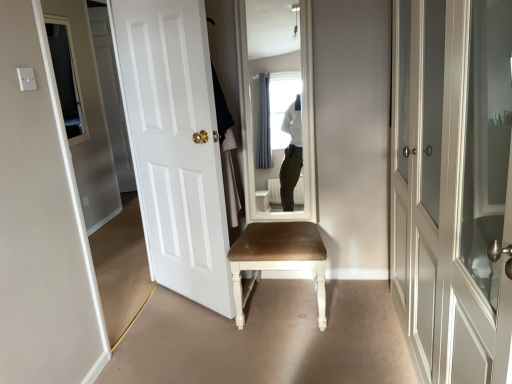
Question: Is white painted wood door at center, the 2th door from the left, at the left side of white cotton robe at center?

Choices:
 (A) no
 (B) yes

Answer: (B)

Question: Is white painted wood door at center, which appears as the second door when viewed from the right, not within white cotton robe at center?

Choices:
 (A) no
 (B) yes

Answer: (B)

Question: Does white painted wood door at center, which appears as the second door when viewed from the right, have a lesser height compared to white cotton robe at center?

Choices:
 (A) no
 (B) yes

Answer: (A)

Question: Is white painted wood door at center, which appears as the second door when viewed from the right, oriented towards white cotton robe at center?

Choices:
 (A) no
 (B) yes

Answer: (B)

Question: From a real-world perspective, is white painted wood door at center, the 2th door from the left, positioned over white cotton robe at center based on gravity?

Choices:
 (A) no
 (B) yes

Answer: (A)

Question: Does point (249, 246) appear closer or farther from the camera than point (229, 160)?

Choices:
 (A) farther
 (B) closer

Answer: (B)

Question: From the image's perspective, relative to white cotton robe at center, is brown leather chair at center above or below?

Choices:
 (A) below
 (B) above

Answer: (A)

Question: From a real-world perspective, is brown leather chair at center physically located above or below white cotton robe at center?

Choices:
 (A) above
 (B) below

Answer: (B)

Question: Considering the positions of brown leather chair at center and white cotton robe at center in the image, is brown leather chair at center bigger or smaller than white cotton robe at center?

Choices:
 (A) small
 (B) big

Answer: (B)

Question: Does point (18, 142) appear closer or farther from the camera than point (225, 122)?

Choices:
 (A) closer
 (B) farther

Answer: (A)

Question: Is white matte door at left, arranged as the third door when viewed from the right, bigger or smaller than white cotton robe at center?

Choices:
 (A) small
 (B) big

Answer: (B)

Question: From a real-world perspective, is white matte door at left, acting as the 1th door starting from the left, physically located above or below white cotton robe at center?

Choices:
 (A) above
 (B) below

Answer: (B)

Question: Which is correct: white matte door at left, arranged as the third door when viewed from the right, is inside white cotton robe at center, or outside of it?

Choices:
 (A) inside
 (B) outside

Answer: (B)

Question: Would you say white cotton robe at center is to the left or to the right of white painted wood door at center, the 2th door from the left, in the picture?

Choices:
 (A) left
 (B) right

Answer: (B)

Question: Considering the positions of point (223, 180) and point (199, 147), is point (223, 180) closer or farther from the camera than point (199, 147)?

Choices:
 (A) closer
 (B) farther

Answer: (A)